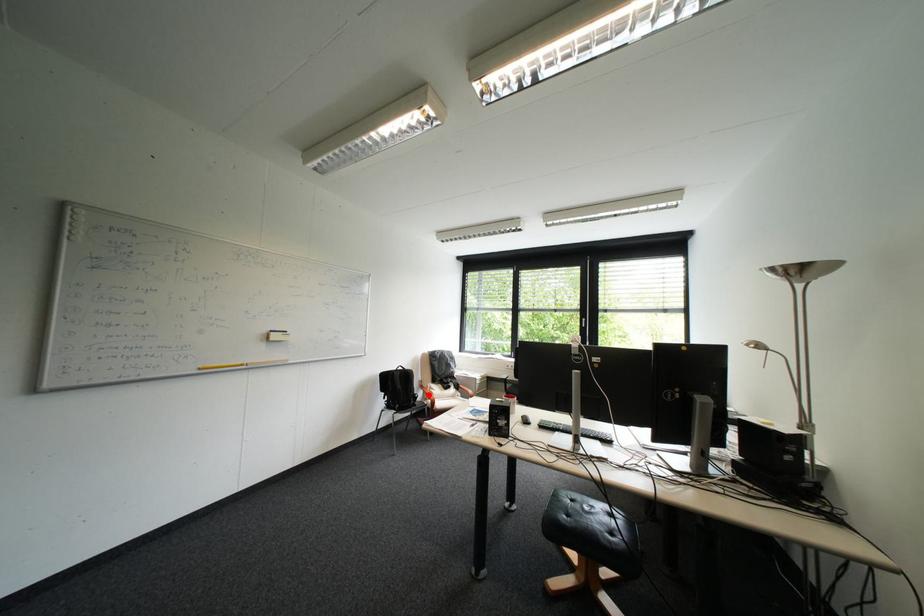
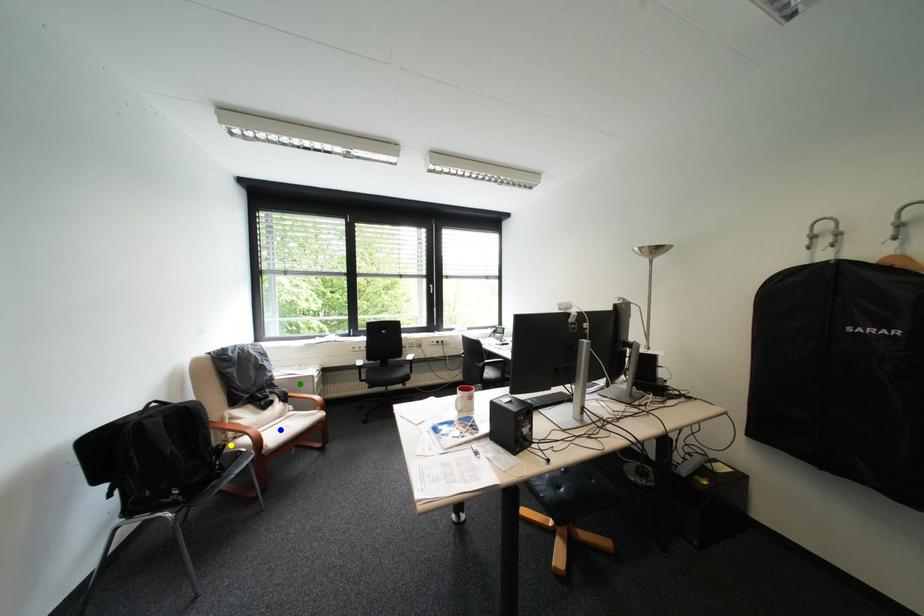
Question: I am providing you with two images of the same scene from different viewpoints. A red point is marked on the first image. You are given multiple points on the second image. Which spot in image 2 lines up with the point in image 1?

Choices:
 (A) green point
 (B) blue point
 (C) yellow point

Answer: (C)